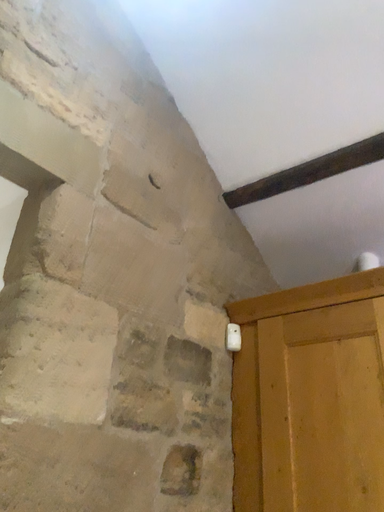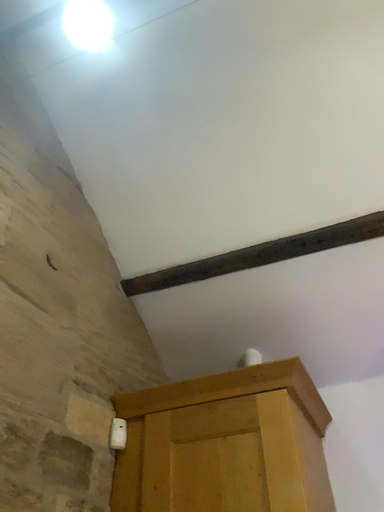
Question: Which way did the camera rotate in the video?

Choices:
 (A) rotated left
 (B) rotated right

Answer: (B)